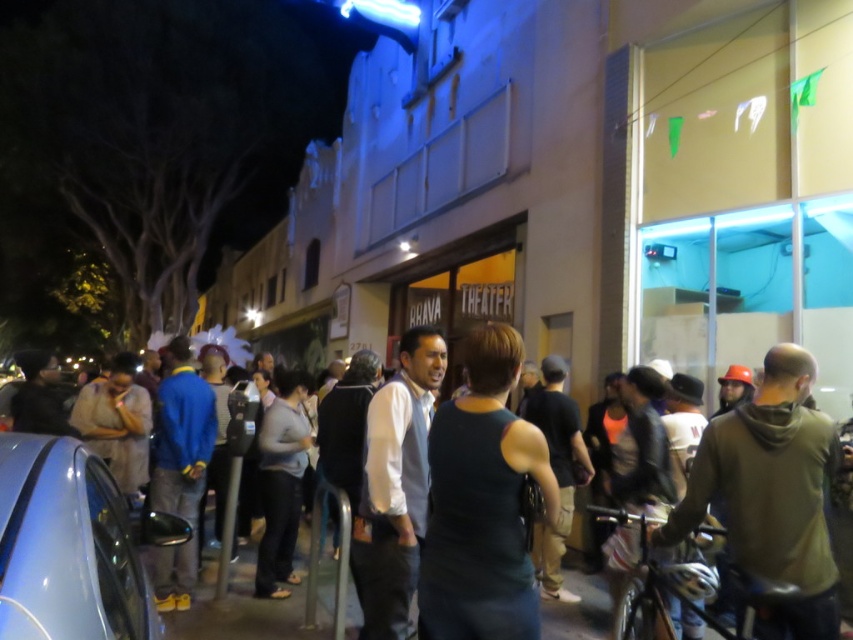
Question: Considering the relative positions of dark green tank top at center and dark gray tank top at center in the image provided, where is dark green tank top at center located with respect to dark gray tank top at center?

Choices:
 (A) left
 (B) right

Answer: (B)

Question: Which of the following is the farthest from the observer?

Choices:
 (A) white shirt at center
 (B) metallic blue car at lower left
 (C) dark green tank top at center
 (D) dark gray tank top at center

Answer: (D)

Question: Estimate the real-world distances between objects in this image. Which object is farther from the green hoodie at center?

Choices:
 (A) dark gray tank top at center
 (B) dark green tank top at center

Answer: (A)

Question: Which object is the closest to the dark green tank top at center?

Choices:
 (A) green hoodie at center
 (B) metallic blue car at lower left
 (C) white shirt at center

Answer: (C)

Question: Where is dark green tank top at center located in relation to white shirt at center in the image?

Choices:
 (A) left
 (B) right

Answer: (B)

Question: Is white shirt at center bigger than dark gray tank top at center?

Choices:
 (A) no
 (B) yes

Answer: (A)